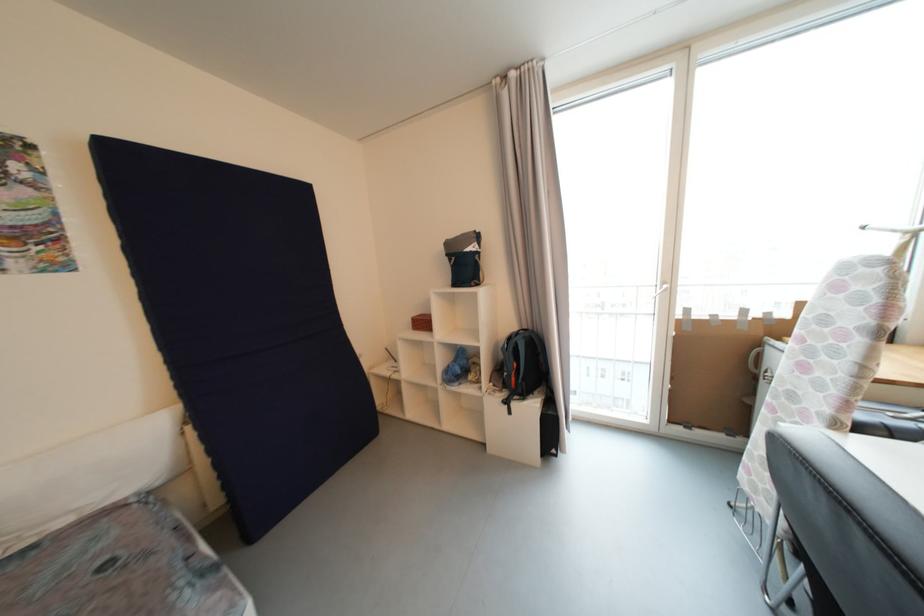
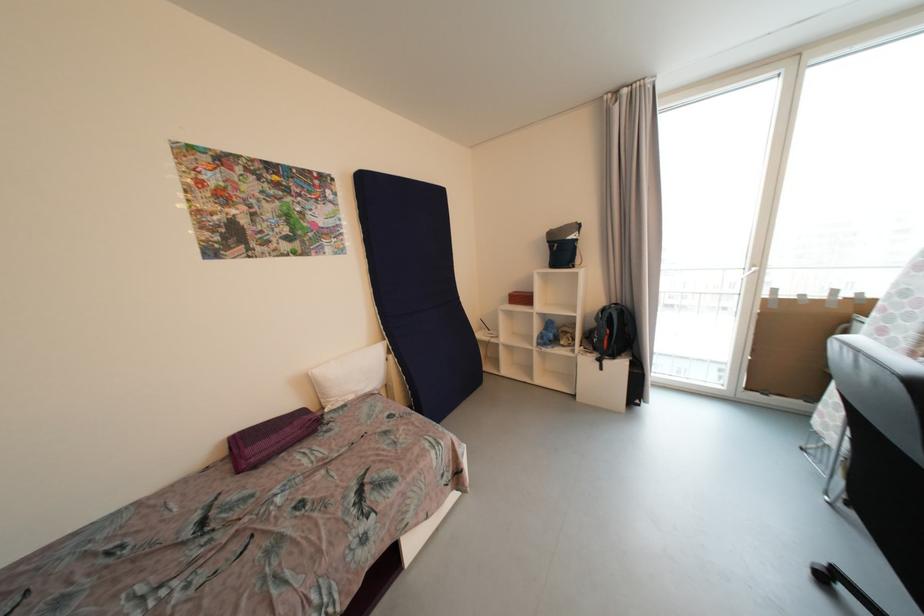
Locate, in the second image, the point that corresponds to the point at 451,373 in the first image.

(545, 339)